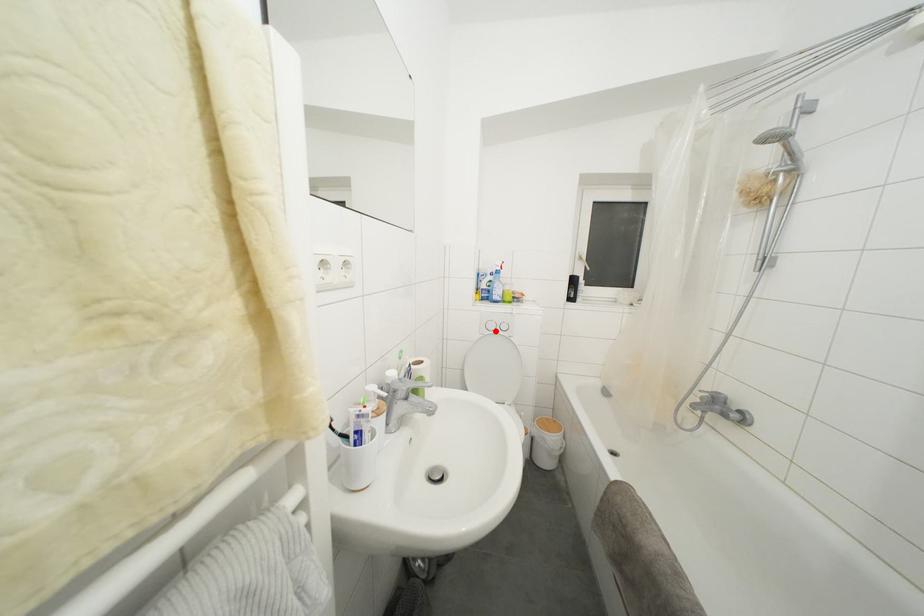
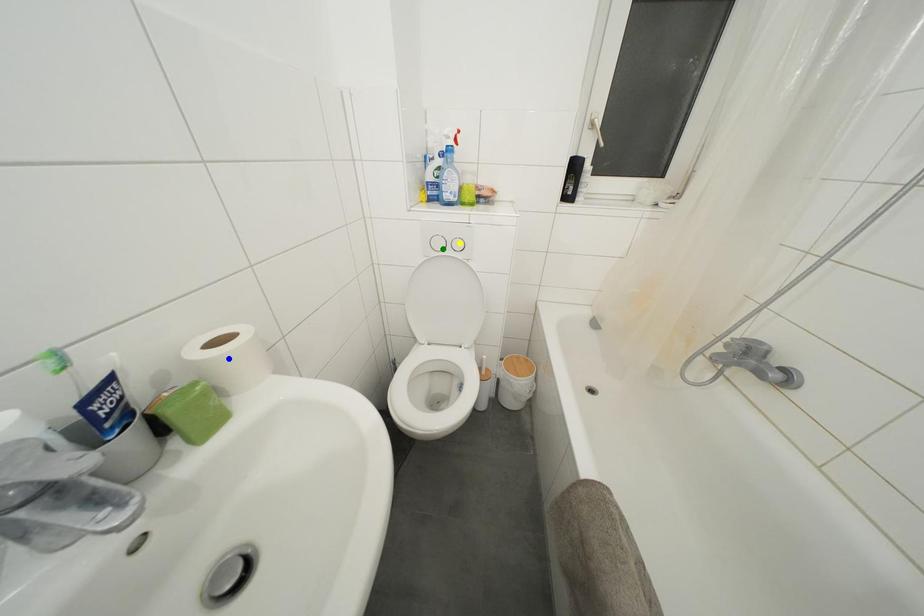
Question: I am providing you with two images of the same scene from different viewpoints. A red point is marked on the first image. You are given multiple points on the second image. In image 2, which mark is for the same physical point as the one in image 1?

Choices:
 (A) yellow point
 (B) blue point
 (C) green point

Answer: (C)